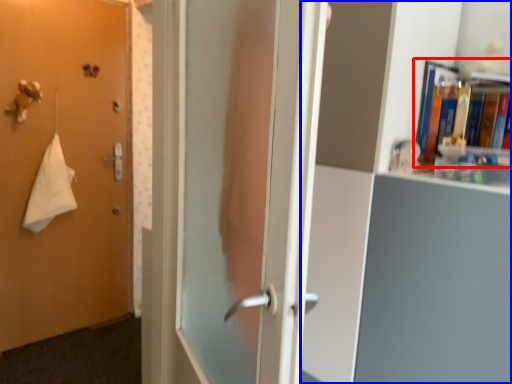
Question: Which object is closer to the camera taking this photo, book (highlighted by a red box) or bookcase (highlighted by a blue box)?

Choices:
 (A) book
 (B) bookcase

Answer: (B)